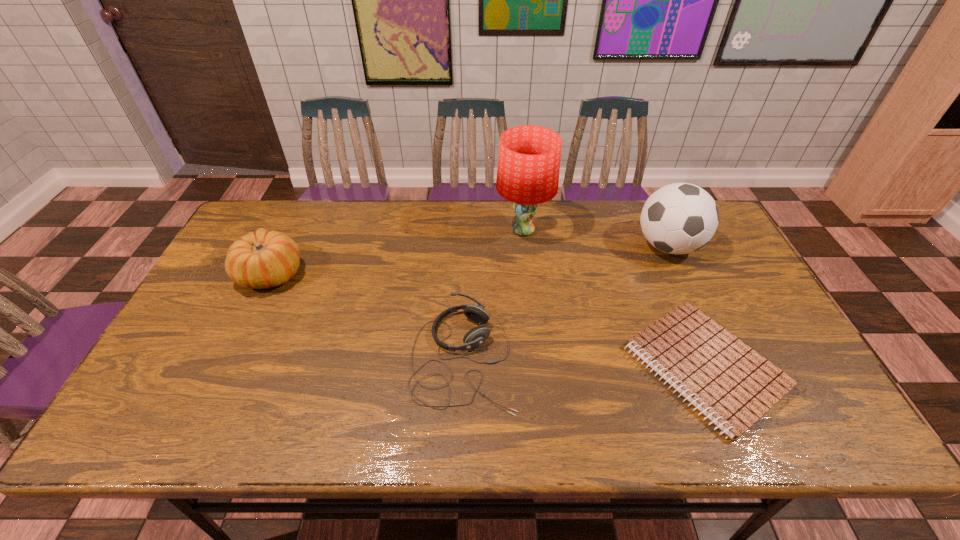
At what (x,y) coordinates should I click in order to perform the action: click on free point that satisfies the following two spatial constraints: 1. on the outer surface of the headset; 2. on the left side of the notebook. Please return your answer as a coordinate pair (x, y). This screenshot has width=960, height=540. Looking at the image, I should click on (463, 367).